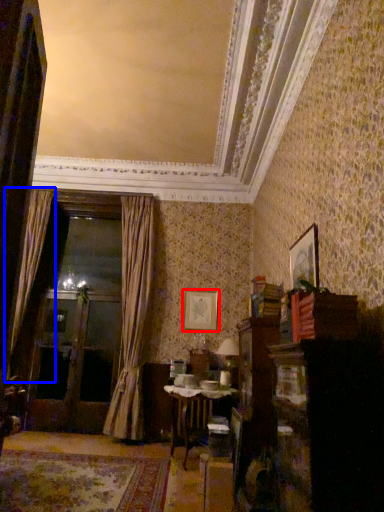
Question: Which of the following is the closest to the observer, picture frame (highlighted by a red box) or curtain (highlighted by a blue box)?

Choices:
 (A) picture frame
 (B) curtain

Answer: (B)